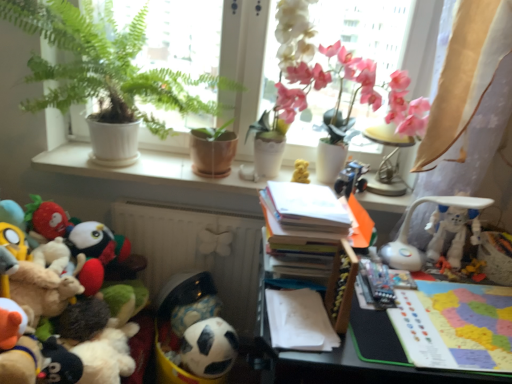
The height and width of the screenshot is (384, 512). Find the location of `vacant area on top of multicolored paper map at right, which is the second book from top to bottom (from a real-world perspective)`. vacant area on top of multicolored paper map at right, which is the second book from top to bottom (from a real-world perspective) is located at coordinates (462, 317).